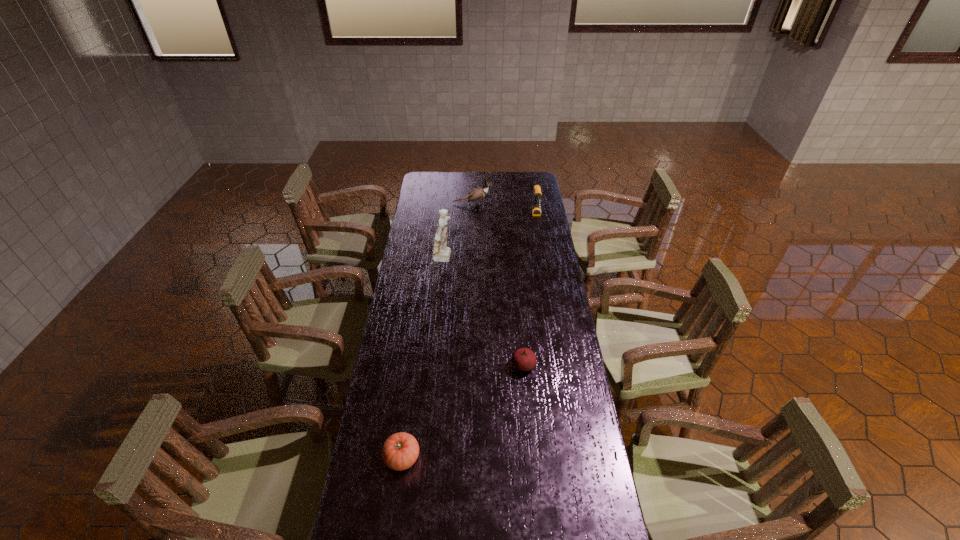
Locate an element on the screen. The image size is (960, 540). free space located on the handle side of the rightmost object is located at coordinates (548, 282).

I want to click on vacant point located on the back of the second object from right to left, so click(x=516, y=288).

Where is `vacant region located on the back of the left tomato`? This screenshot has width=960, height=540. vacant region located on the back of the left tomato is located at coordinates (416, 354).

This screenshot has height=540, width=960. Find the location of `figurine that is positioned at the left edge`. figurine that is positioned at the left edge is located at coordinates (442, 253).

Identify the location of tomato present at the left edge. (400, 451).

The width and height of the screenshot is (960, 540). Find the location of `drill that is at the right edge`. drill that is at the right edge is located at coordinates (536, 207).

The image size is (960, 540). I want to click on tomato located in the right edge section of the desktop, so click(x=523, y=359).

At what (x,y) coordinates should I click in order to perform the action: click on vacant area at the far edge. Please return your answer as a coordinate pair (x, y). Looking at the image, I should click on (460, 186).

Image resolution: width=960 pixels, height=540 pixels. I want to click on vacant region at the left edge of the desktop, so (395, 306).

Find the location of `free space at the right edge`. free space at the right edge is located at coordinates (547, 213).